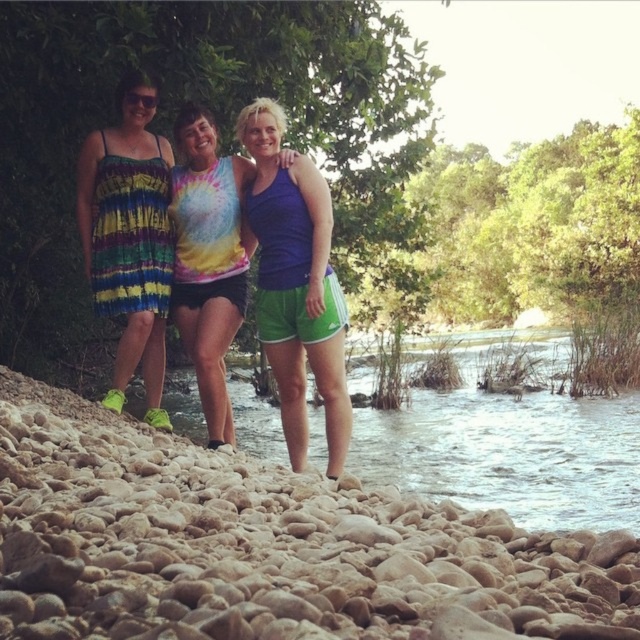
Question: Is matte blue tank top at center further to camera compared to rainbow striped dress at left?

Choices:
 (A) yes
 (B) no

Answer: (B)

Question: Considering the real-world distances, which object is farthest from the matte blue tank top at center?

Choices:
 (A) rainbow tie-dye tank top at center
 (B) rainbow striped dress at left
 (C) brown pebbles at lower left

Answer: (C)

Question: Which point is closer to the camera taking this photo?

Choices:
 (A) (220, 424)
 (B) (260, 150)
 (C) (144, 116)
 (D) (68, 560)

Answer: (D)

Question: Does brown pebbles at lower left have a smaller size compared to rainbow striped dress at left?

Choices:
 (A) yes
 (B) no

Answer: (B)

Question: Does matte blue tank top at center have a lesser width compared to rainbow striped dress at left?

Choices:
 (A) yes
 (B) no

Answer: (B)

Question: Estimate the real-world distances between objects in this image. Which object is farther from the brown pebbles at lower left?

Choices:
 (A) matte blue tank top at center
 (B) rainbow tie-dye tank top at center

Answer: (B)